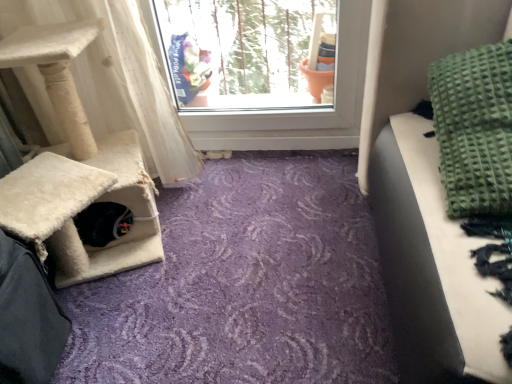
The height and width of the screenshot is (384, 512). What are the coordinates of `free spot to the right of white textured curtain at left` in the screenshot? It's located at (242, 230).